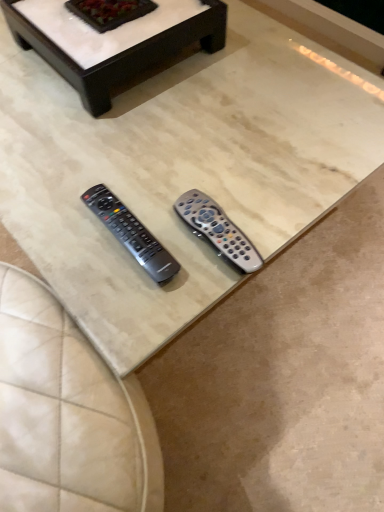
Question: Is beige marble coffee table at center, acting as the 2th coffee table starting from the back, touching silver metallic remote at center, which ranks as the second remote control in right-to-left order?

Choices:
 (A) yes
 (B) no

Answer: (B)

Question: Considering the relative sizes of beige marble coffee table at center, the first coffee table in the front-to-back sequence, and silver metallic remote at center, which is counted as the first remote control, starting from the left, in the image provided, is beige marble coffee table at center, the first coffee table in the front-to-back sequence, wider than silver metallic remote at center, which is counted as the first remote control, starting from the left,?

Choices:
 (A) no
 (B) yes

Answer: (B)

Question: Does beige marble coffee table at center, the first coffee table in the front-to-back sequence, have a larger size compared to silver metallic remote at center, which ranks as the second remote control in right-to-left order?

Choices:
 (A) no
 (B) yes

Answer: (B)

Question: Is the depth of beige marble coffee table at center, acting as the 2th coffee table starting from the back, greater than that of silver metallic remote at center, which is counted as the first remote control, starting from the left?

Choices:
 (A) no
 (B) yes

Answer: (A)

Question: Considering the relative positions of beige marble coffee table at center, acting as the 2th coffee table starting from the back, and silver metallic remote at center, which is counted as the first remote control, starting from the left, in the image provided, is beige marble coffee table at center, acting as the 2th coffee table starting from the back, in front of silver metallic remote at center, which is counted as the first remote control, starting from the left,?

Choices:
 (A) yes
 (B) no

Answer: (A)

Question: Could you tell me if beige marble coffee table at center, acting as the 2th coffee table starting from the back, is facing silver metallic remote at center, which is counted as the first remote control, starting from the left?

Choices:
 (A) yes
 (B) no

Answer: (B)

Question: Is silver metallic remote at center, which ranks as the second remote control in right-to-left order, turned away from translucent gray remote at center, positioned as the 2th remote control in left-to-right order?

Choices:
 (A) yes
 (B) no

Answer: (A)

Question: Is silver metallic remote at center, which ranks as the second remote control in right-to-left order, closer to camera compared to translucent gray remote at center, arranged as the 1th remote control when viewed from the right?

Choices:
 (A) yes
 (B) no

Answer: (A)

Question: Considering the relative sizes of silver metallic remote at center, which is counted as the first remote control, starting from the left, and translucent gray remote at center, arranged as the 1th remote control when viewed from the right, in the image provided, is silver metallic remote at center, which is counted as the first remote control, starting from the left, shorter than translucent gray remote at center, arranged as the 1th remote control when viewed from the right,?

Choices:
 (A) no
 (B) yes

Answer: (B)

Question: From a real-world perspective, is silver metallic remote at center, which ranks as the second remote control in right-to-left order, physically above translucent gray remote at center, arranged as the 1th remote control when viewed from the right?

Choices:
 (A) yes
 (B) no

Answer: (A)

Question: Would you consider silver metallic remote at center, which ranks as the second remote control in right-to-left order, to be distant from translucent gray remote at center, arranged as the 1th remote control when viewed from the right?

Choices:
 (A) no
 (B) yes

Answer: (A)

Question: Can you confirm if silver metallic remote at center, which ranks as the second remote control in right-to-left order, is thinner than translucent gray remote at center, arranged as the 1th remote control when viewed from the right?

Choices:
 (A) no
 (B) yes

Answer: (B)

Question: Is white marble coffee table at upper center, which ranks as the first coffee table in back-to-front order, with silver metallic remote at center, which is counted as the first remote control, starting from the left?

Choices:
 (A) yes
 (B) no

Answer: (B)